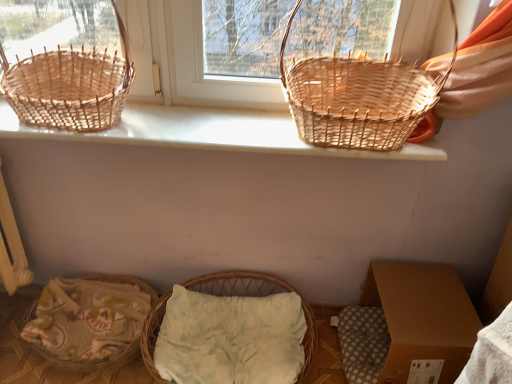
Find the location of a particular element. The image size is (512, 384). empty space that is ontop of woven wood baskets at upper center is located at coordinates (191, 124).